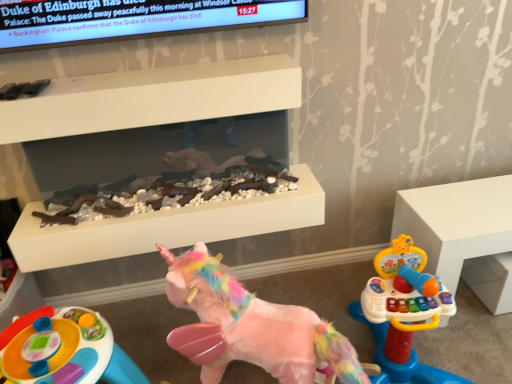
What is the approximate height of white matte fireplace at upper center?

5.79 inches.

Find the location of `plastic colorful activity table at lower left, the first toy positioned from the left`. plastic colorful activity table at lower left, the first toy positioned from the left is located at coordinates (64, 350).

This screenshot has width=512, height=384. I want to click on white plastic toy at right, so click(x=464, y=234).

This screenshot has height=384, width=512. What are the coordinates of `white matte fireplace at upper center` in the screenshot? It's located at (165, 227).

From the image's perspective, who appears lower, white plastic toy at right or plastic colorful activity table at lower left, the first toy positioned from the left?

plastic colorful activity table at lower left, the first toy positioned from the left.

Is plastic colorful activity table at lower left, the 2th toy when ordered from right to left, completely or partially inside white plastic toy at right?

No, plastic colorful activity table at lower left, the 2th toy when ordered from right to left, is not inside white plastic toy at right.

Is white plastic toy at right further to camera compared to plastic colorful activity table at lower left, the first toy positioned from the left?

Yes, the depth of white plastic toy at right is greater than that of plastic colorful activity table at lower left, the first toy positioned from the left.

Is white plastic toy at right positioned with its back to plastic colorful activity table at lower left, the first toy positioned from the left?

white plastic toy at right is not turned away from plastic colorful activity table at lower left, the first toy positioned from the left.

Does fluffy pink unicorn at center, positioned as the 2th toy in left-to-right order, turn towards white plastic toy at right?

No, fluffy pink unicorn at center, positioned as the 2th toy in left-to-right order, is not aimed at white plastic toy at right.

Which toy is the 2nd one when counting from the front of the white plastic toy at right? Please provide its 2D coordinates.

[(256, 324)]

Between point (295, 328) and point (461, 226), which one is positioned in front?

The point (295, 328) is in front.

Is fluffy pink unicorn at center, which is the 1th toy from right to left, thinner than white plastic toy at right?

Yes, fluffy pink unicorn at center, which is the 1th toy from right to left, is thinner than white plastic toy at right.

How distant is fluffy pink unicorn at center, positioned as the 2th toy in left-to-right order, from plastic colorful activity table at lower left, the 2th toy when ordered from right to left?

They are 38.77 centimeters apart.

Considering the sizes of objects fluffy pink unicorn at center, which is the 1th toy from right to left, and plastic colorful activity table at lower left, the first toy positioned from the left, in the image provided, who is smaller, fluffy pink unicorn at center, which is the 1th toy from right to left, or plastic colorful activity table at lower left, the first toy positioned from the left,?

With smaller size is plastic colorful activity table at lower left, the first toy positioned from the left.

In the image, is fluffy pink unicorn at center, which is the 1th toy from right to left, positioned in front of or behind plastic colorful activity table at lower left, the first toy positioned from the left?

fluffy pink unicorn at center, which is the 1th toy from right to left, is positioned closer to the viewer than plastic colorful activity table at lower left, the first toy positioned from the left.

Is fluffy pink unicorn at center, positioned as the 2th toy in left-to-right order, to the left or to the right of plastic colorful activity table at lower left, the first toy positioned from the left, in the image?

Clearly, fluffy pink unicorn at center, positioned as the 2th toy in left-to-right order, is on the right of plastic colorful activity table at lower left, the first toy positioned from the left, in the image.

Is white matte fireplace at upper center not within plastic colorful activity table at lower left, the 2th toy when ordered from right to left?

Indeed, white matte fireplace at upper center is completely outside plastic colorful activity table at lower left, the 2th toy when ordered from right to left.

Does point (41, 253) lie in front of point (52, 341)?

No.

Considering the sizes of white matte fireplace at upper center and plastic colorful activity table at lower left, the first toy positioned from the left, in the image, is white matte fireplace at upper center wider or thinner than plastic colorful activity table at lower left, the first toy positioned from the left,?

white matte fireplace at upper center is thinner than plastic colorful activity table at lower left, the first toy positioned from the left.

Is white matte fireplace at upper center to the left or to the right of fluffy pink unicorn at center, which is the 1th toy from right to left, in the image?

From the image, it's evident that white matte fireplace at upper center is to the left of fluffy pink unicorn at center, which is the 1th toy from right to left.

Measure the distance between white matte fireplace at upper center and fluffy pink unicorn at center, which is the 1th toy from right to left.

13.17 inches.

The height and width of the screenshot is (384, 512). Identify the location of the 1st toy directly beneath the white matte fireplace at upper center (from a real-world perspective). (256, 324).

From a real-world perspective, between white matte fireplace at upper center and fluffy pink unicorn at center, which is the 1th toy from right to left, who is vertically higher?

white matte fireplace at upper center.

Based on the photo, is white matte fireplace at upper center looking in the opposite direction of white plastic toy at right?

No, white matte fireplace at upper center is not facing the opposite direction of white plastic toy at right.

From a real-world perspective, is white matte fireplace at upper center located higher than white plastic toy at right?

Yes, from a real-world perspective, white matte fireplace at upper center is on top of white plastic toy at right.

Can you confirm if white matte fireplace at upper center is smaller than white plastic toy at right?

Yes, white matte fireplace at upper center is smaller than white plastic toy at right.

Considering the sizes of objects white matte fireplace at upper center and white plastic toy at right in the image provided, who is thinner, white matte fireplace at upper center or white plastic toy at right?

Thinner between the two is white matte fireplace at upper center.

Looking at this image, which point is more forward, (x=75, y=337) or (x=166, y=218)?

The point (x=75, y=337) is more forward.

How far apart are plastic colorful activity table at lower left, the 2th toy when ordered from right to left, and white matte fireplace at upper center?

plastic colorful activity table at lower left, the 2th toy when ordered from right to left, and white matte fireplace at upper center are 13.98 inches apart from each other.

Is the position of plastic colorful activity table at lower left, the first toy positioned from the left, more distant than that of white matte fireplace at upper center?

No, the depth of plastic colorful activity table at lower left, the first toy positioned from the left, is less than that of white matte fireplace at upper center.

Is plastic colorful activity table at lower left, the first toy positioned from the left, with white matte fireplace at upper center?

No, plastic colorful activity table at lower left, the first toy positioned from the left, is not next to white matte fireplace at upper center.

The image size is (512, 384). I want to click on toy below the white plastic toy at right (from a real-world perspective), so click(64, 350).

Find the location of a particular element. furniture above the fluffy pink unicorn at center, which is the 1th toy from right to left (from the image's perspective) is located at coordinates 464,234.

From the image, which object appears to be nearer to white plastic toy at right, fluffy pink unicorn at center, positioned as the 2th toy in left-to-right order, or plastic colorful activity table at lower left, the first toy positioned from the left?

fluffy pink unicorn at center, positioned as the 2th toy in left-to-right order, lies closer to white plastic toy at right than the other object.

Based on their spatial positions, is plastic colorful activity table at lower left, the 2th toy when ordered from right to left, or white plastic toy at right further from fluffy pink unicorn at center, positioned as the 2th toy in left-to-right order?

Among the two, white plastic toy at right is located further to fluffy pink unicorn at center, positioned as the 2th toy in left-to-right order.

Based on their spatial positions, is white matte fireplace at upper center or fluffy pink unicorn at center, which is the 1th toy from right to left, closer to plastic colorful activity table at lower left, the 2th toy when ordered from right to left?

white matte fireplace at upper center is closer to plastic colorful activity table at lower left, the 2th toy when ordered from right to left.

Which object lies further to the anchor point plastic colorful activity table at lower left, the 2th toy when ordered from right to left, white plastic toy at right or white matte fireplace at upper center?

white plastic toy at right is positioned further to the anchor plastic colorful activity table at lower left, the 2th toy when ordered from right to left.

Based on their spatial positions, is white plastic toy at right or white matte fireplace at upper center closer to fluffy pink unicorn at center, which is the 1th toy from right to left?

white matte fireplace at upper center lies closer to fluffy pink unicorn at center, which is the 1th toy from right to left, than the other object.

Considering their positions, is white plastic toy at right positioned further to white matte fireplace at upper center than plastic colorful activity table at lower left, the first toy positioned from the left?

Among the two, white plastic toy at right is located further to white matte fireplace at upper center.

Consider the image. Based on their spatial positions, is fluffy pink unicorn at center, which is the 1th toy from right to left, or white plastic toy at right closer to plastic colorful activity table at lower left, the first toy positioned from the left?

fluffy pink unicorn at center, which is the 1th toy from right to left, lies closer to plastic colorful activity table at lower left, the first toy positioned from the left, than the other object.

From the image, which object appears to be nearer to plastic colorful activity table at lower left, the 2th toy when ordered from right to left, white plastic toy at right or fluffy pink unicorn at center, which is the 1th toy from right to left?

fluffy pink unicorn at center, which is the 1th toy from right to left, is closer to plastic colorful activity table at lower left, the 2th toy when ordered from right to left.

I want to click on table located between plastic colorful activity table at lower left, the 2th toy when ordered from right to left, and fluffy pink unicorn at center, which is the 1th toy from right to left, in the left-right direction, so click(x=165, y=227).

Find the location of `toy situated between plastic colorful activity table at lower left, the 2th toy when ordered from right to left, and white plastic toy at right from left to right`. toy situated between plastic colorful activity table at lower left, the 2th toy when ordered from right to left, and white plastic toy at right from left to right is located at coordinates (256, 324).

Where is `toy located between white matte fireplace at upper center and white plastic toy at right in the left-right direction`? toy located between white matte fireplace at upper center and white plastic toy at right in the left-right direction is located at coordinates (256, 324).

You are a GUI agent. You are given a task and a screenshot of the screen. Output one action in this format:
    pyautogui.click(x=<x>, y=<y>)
    Task: Click on the table between plastic colorful activity table at lower left, the first toy positioned from the left, and white plastic toy at right from left to right
    The height and width of the screenshot is (384, 512).
    Given the screenshot: What is the action you would take?
    pyautogui.click(x=165, y=227)